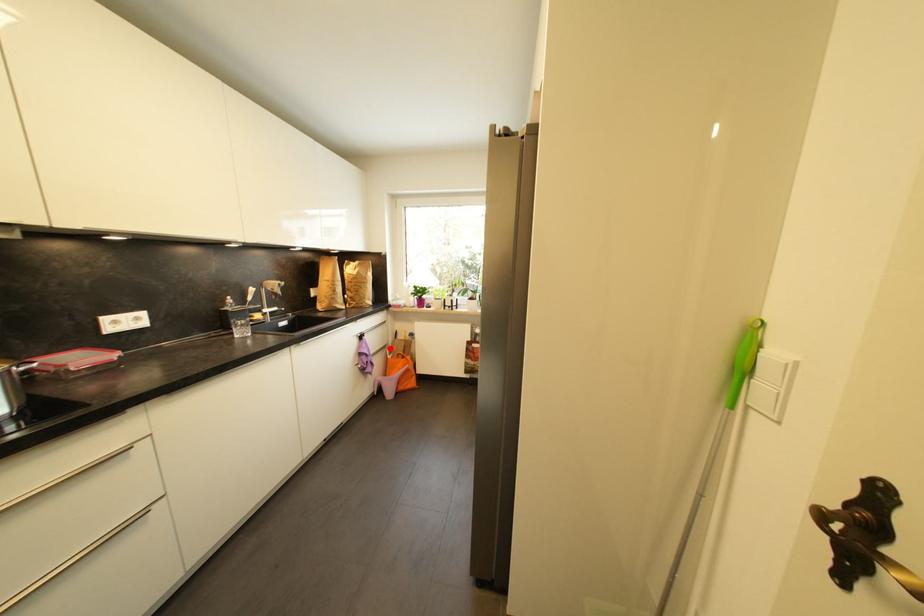
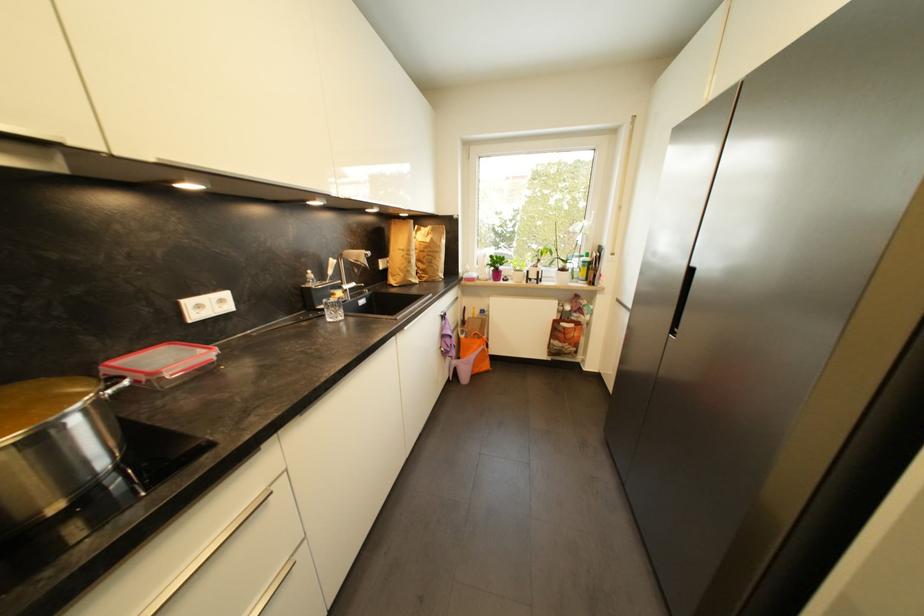
Find the pixel in the second image that matches the highlighted location in the first image.

(463, 328)